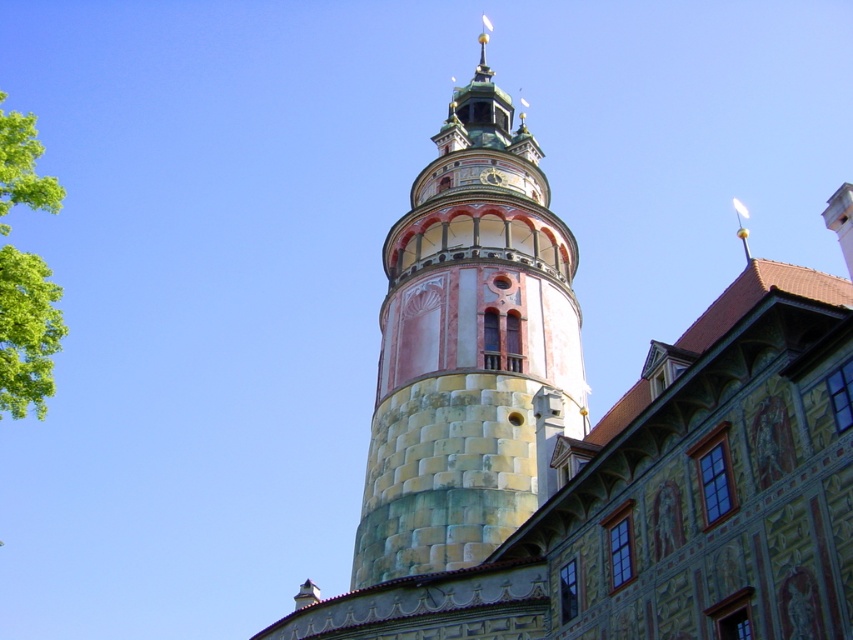
Question: Which object is farther from the camera taking this photo?

Choices:
 (A) stone tower at center
 (B) green leafy tree at left

Answer: (A)

Question: Does stone tower at center appear under green leafy tree at left?

Choices:
 (A) yes
 (B) no

Answer: (B)

Question: Can you confirm if stone tower at center is positioned to the right of green leafy tree at left?

Choices:
 (A) no
 (B) yes

Answer: (B)

Question: Which point is farther from the camera taking this photo?

Choices:
 (A) (59, 312)
 (B) (424, 196)

Answer: (B)

Question: Does stone tower at center have a larger size compared to green leafy tree at left?

Choices:
 (A) yes
 (B) no

Answer: (B)

Question: Which object is farther from the camera taking this photo?

Choices:
 (A) green leafy tree at left
 (B) stone tower at center

Answer: (B)